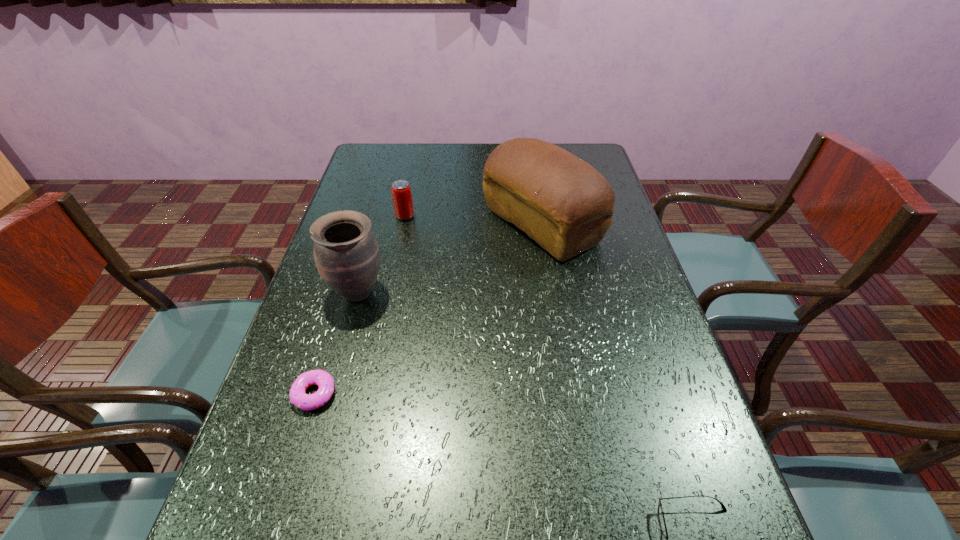
This screenshot has height=540, width=960. In order to click on free area in between the third shortest object and the bread in this screenshot , I will do `click(473, 220)`.

I want to click on free space between the fourth farthest object and the urn, so click(336, 343).

Locate an element on the screen. The width and height of the screenshot is (960, 540). free space between the doughnut and the bread is located at coordinates (428, 309).

Locate which object ranks fourth in proximity to the fourth farthest object. Please provide its 2D coordinates. Your answer should be formatted as a tuple, i.e. [(x, y)], where the tuple contains the x and y coordinates of a point satisfying the conditions above.

[(661, 518)]

Identify which object is the closest to the bread. Please provide its 2D coordinates. Your answer should be formatted as a tuple, i.e. [(x, y)], where the tuple contains the x and y coordinates of a point satisfying the conditions above.

[(401, 192)]

This screenshot has height=540, width=960. Identify the location of free region that satisfies the following two spatial constraints: 1. on the back side of the bread; 2. on the left side of the second nearest object. (366, 225).

Image resolution: width=960 pixels, height=540 pixels. Identify the location of free region that satisfies the following two spatial constraints: 1. on the back side of the third tallest object; 2. on the left side of the urn. (378, 216).

You are a GUI agent. You are given a task and a screenshot of the screen. Output one action in this format:
    pyautogui.click(x=<x>, y=<y>)
    Task: Click on the vacant point that satisfies the following two spatial constraints: 1. on the front side of the bread; 2. on the right side of the third shortest object
    The height and width of the screenshot is (540, 960).
    Given the screenshot: What is the action you would take?
    pyautogui.click(x=403, y=225)